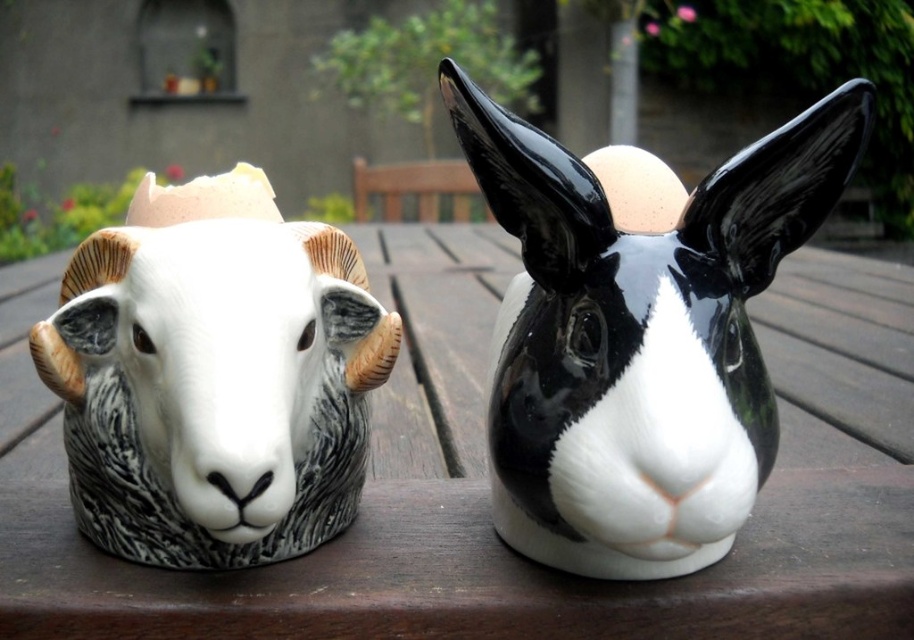
You are standing in a garden and want to place a 12 inch wide basket on the wooden picnic table at center. Can the basket fit on the table?

The distance between the wooden picnic table at center and the camera is 32.02 inches, but this measurement does not provide information about the table width. Therefore, it is unclear if the basket will fit.

You are trying to fit both the black glossy ram head at center and the white glossy ram head at left into a rectangular box. The box can only accommodate items up to the width of the wider of the two. Which ram head determines the minimum required width of the box?

The black glossy ram head at center might be wider than white glossy ram head at left, so the box must be at least as wide as the black glossy ram head at center to fit both.